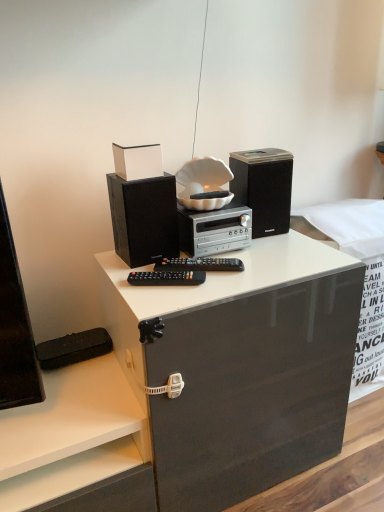
This screenshot has width=384, height=512. Describe the element at coordinates (137, 161) in the screenshot. I see `white glossy box at upper center` at that location.

Image resolution: width=384 pixels, height=512 pixels. In order to click on black plastic remote control at center in this screenshot , I will do `click(166, 278)`.

Looking at this image, considering the sizes of objects black matte speaker at upper right, the second speaker positioned from the left, and black plastic remote control at center in the image provided, who is thinner, black matte speaker at upper right, the second speaker positioned from the left, or black plastic remote control at center?

With smaller width is black plastic remote control at center.

Is black matte speaker at upper right, the second speaker positioned from the left, completely or partially outside of black plastic remote control at center?

Indeed, black matte speaker at upper right, the second speaker positioned from the left, is completely outside black plastic remote control at center.

From a real-world perspective, is black matte speaker at upper right, arranged as the first speaker when viewed from the right, on black plastic remote control at center?

Yes, from a real-world perspective, black matte speaker at upper right, arranged as the first speaker when viewed from the right, is above black plastic remote control at center.

The image size is (384, 512). In order to click on speaker lying on the right of black plastic remote control at center in this screenshot , I will do `click(264, 188)`.

Is silver metallic stereo at center further to camera compared to black matte speaker at upper right, arranged as the first speaker when viewed from the right?

No, it is not.

Considering the points (206, 239) and (278, 223), which point is in front, point (206, 239) or point (278, 223)?

The point (206, 239) is closer.

Who is bigger, silver metallic stereo at center or black matte speaker at upper right, the second speaker positioned from the left?

Bigger between the two is silver metallic stereo at center.

From the image's perspective, is silver metallic stereo at center located above black matte speaker at upper right, arranged as the first speaker when viewed from the right?

Actually, silver metallic stereo at center appears below black matte speaker at upper right, arranged as the first speaker when viewed from the right, in the image.

Who is more distant, black plastic remote control at center or black plastic remote control at center?

black plastic remote control at center is more distant.

From the image's perspective, who appears lower, black plastic remote control at center or black plastic remote control at center?

black plastic remote control at center.

Is black plastic remote control at center shorter than black plastic remote control at center?

In fact, black plastic remote control at center may be taller than black plastic remote control at center.

Would you say black plastic remote control at center is part of black plastic remote control at center's contents?

No, black plastic remote control at center is located outside of black plastic remote control at center.

What's the angular difference between silver metallic stereo at center and white glossy box at upper center's facing directions?

silver metallic stereo at center and white glossy box at upper center are facing 1.93 degrees away from each other.

Considering the relative positions of silver metallic stereo at center and white glossy box at upper center in the image provided, is silver metallic stereo at center in front of white glossy box at upper center?

No, silver metallic stereo at center is further to the viewer.

Is silver metallic stereo at center spatially inside white glossy box at upper center, or outside of it?

silver metallic stereo at center exists outside the volume of white glossy box at upper center.

Based on their positions, is black plastic remote control at center located to the left or right of white glossy box at upper center?

From the image, it's evident that black plastic remote control at center is to the right of white glossy box at upper center.

Looking at the image, does black plastic remote control at center seem bigger or smaller compared to white glossy box at upper center?

Considering their sizes, black plastic remote control at center takes up less space than white glossy box at upper center.

The height and width of the screenshot is (512, 384). Find the location of `box in front of the black plastic remote control at center`. box in front of the black plastic remote control at center is located at coordinates (137, 161).

From a real-world perspective, is black plastic remote control at center above or below white glossy box at upper center?

Clearly, from a real-world perspective, black plastic remote control at center is below white glossy box at upper center.

Considering the sizes of objects black matte speaker at left, the first speaker in the left-to-right sequence, and white glossy box at upper center in the image provided, who is bigger, black matte speaker at left, the first speaker in the left-to-right sequence, or white glossy box at upper center?

Bigger between the two is black matte speaker at left, the first speaker in the left-to-right sequence.

Which object is wider, black matte speaker at left, the first speaker in the left-to-right sequence, or white glossy box at upper center?

black matte speaker at left, the first speaker in the left-to-right sequence.

Is point (118, 189) less distant than point (157, 165)?

No, (118, 189) is behind (157, 165).

In the scene shown: From a real-world perspective, is black matte speaker at left, which ranks as the 2th speaker in right-to-left order, positioned over white glossy box at upper center based on gravity?

Actually, black matte speaker at left, which ranks as the 2th speaker in right-to-left order, is physically below white glossy box at upper center in the real world.

From a real-world perspective, between black plastic remote control at center and white glossy box at upper center, who is vertically higher?

white glossy box at upper center, from a real-world perspective.

Can you confirm if black plastic remote control at center is positioned to the left of white glossy box at upper center?

No.

From the image's perspective, is black plastic remote control at center beneath white glossy box at upper center?

Indeed, from the image's perspective, black plastic remote control at center is shown beneath white glossy box at upper center.

Between black plastic remote control at center and white glossy box at upper center, which one has smaller width?

black plastic remote control at center is thinner.

Where is `equipment below the black matte speaker at upper right, arranged as the first speaker when viewed from the right (from a real-world perspective)`? The height and width of the screenshot is (512, 384). equipment below the black matte speaker at upper right, arranged as the first speaker when viewed from the right (from a real-world perspective) is located at coordinates (166, 278).

Locate an element on the screen. The width and height of the screenshot is (384, 512). speaker behind the silver metallic stereo at center is located at coordinates (264, 188).

Which object lies nearer to the anchor point silver metallic stereo at center, black matte speaker at upper right, the second speaker positioned from the left, or black plastic remote control at center?

Among the two, black matte speaker at upper right, the second speaker positioned from the left, is located nearer to silver metallic stereo at center.

Which object lies nearer to the anchor point black matte speaker at upper right, the second speaker positioned from the left, black matte speaker at left, the first speaker in the left-to-right sequence, or white glossy box at upper center?

black matte speaker at left, the first speaker in the left-to-right sequence, is positioned closer to the anchor black matte speaker at upper right, the second speaker positioned from the left.

Which object lies nearer to the anchor point black matte speaker at upper right, the second speaker positioned from the left, black plastic remote control at center or black plastic remote control at center?

black plastic remote control at center is closer to black matte speaker at upper right, the second speaker positioned from the left.

From the image, which object appears to be nearer to white glossy box at upper center, black matte speaker at left, the first speaker in the left-to-right sequence, or black plastic remote control at center?

black matte speaker at left, the first speaker in the left-to-right sequence, is closer to white glossy box at upper center.

When comparing their distances from black plastic remote control at center, does silver metallic stereo at center or black matte speaker at upper right, the second speaker positioned from the left, seem closer?

The object closer to black plastic remote control at center is silver metallic stereo at center.

Looking at the image, which one is located further to black plastic remote control at center, black matte speaker at upper right, arranged as the first speaker when viewed from the right, or silver metallic stereo at center?

Among the two, black matte speaker at upper right, arranged as the first speaker when viewed from the right, is located further to black plastic remote control at center.

From the image, which object appears to be nearer to black matte speaker at upper right, arranged as the first speaker when viewed from the right, black plastic remote control at center or black plastic remote control at center?

black plastic remote control at center lies closer to black matte speaker at upper right, arranged as the first speaker when viewed from the right, than the other object.

Based on the photo, considering their positions, is silver metallic stereo at center positioned closer to black plastic remote control at center than black plastic remote control at center?

Among the two, black plastic remote control at center is located nearer to black plastic remote control at center.

I want to click on equipment between white glossy box at upper center and black matte speaker at upper right, the second speaker positioned from the left, from left to right, so click(166, 278).

This screenshot has width=384, height=512. In order to click on audio located between black matte speaker at left, which ranks as the 2th speaker in right-to-left order, and black matte speaker at upper right, the second speaker positioned from the left, in the left-right direction in this screenshot , I will do `click(200, 264)`.

Find the location of `home appliance located between black plastic remote control at center and black matte speaker at upper right, the second speaker positioned from the left, in the left-right direction`. home appliance located between black plastic remote control at center and black matte speaker at upper right, the second speaker positioned from the left, in the left-right direction is located at coordinates (214, 229).

The height and width of the screenshot is (512, 384). In order to click on home appliance between white glossy box at upper center and black plastic remote control at center in the up-down direction in this screenshot , I will do `click(214, 229)`.